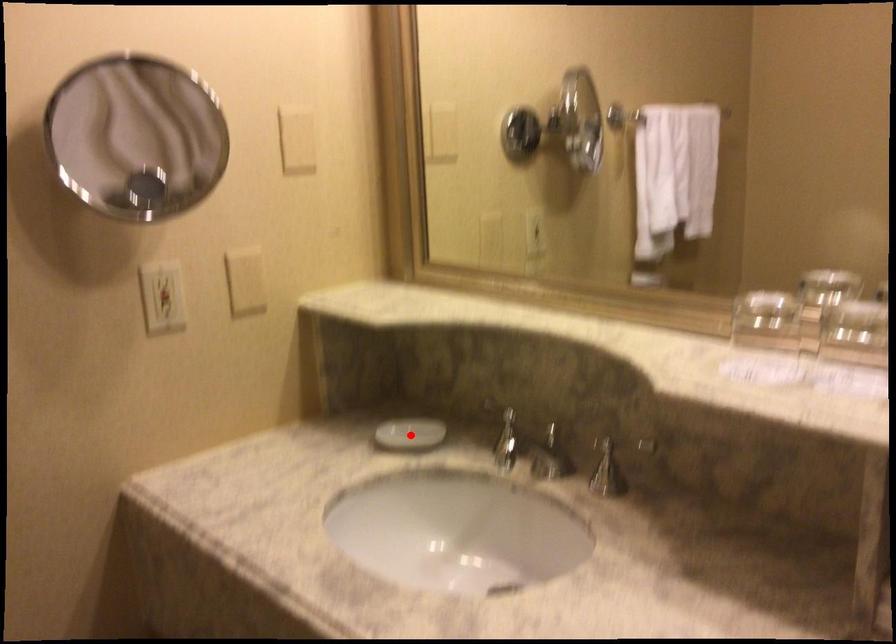
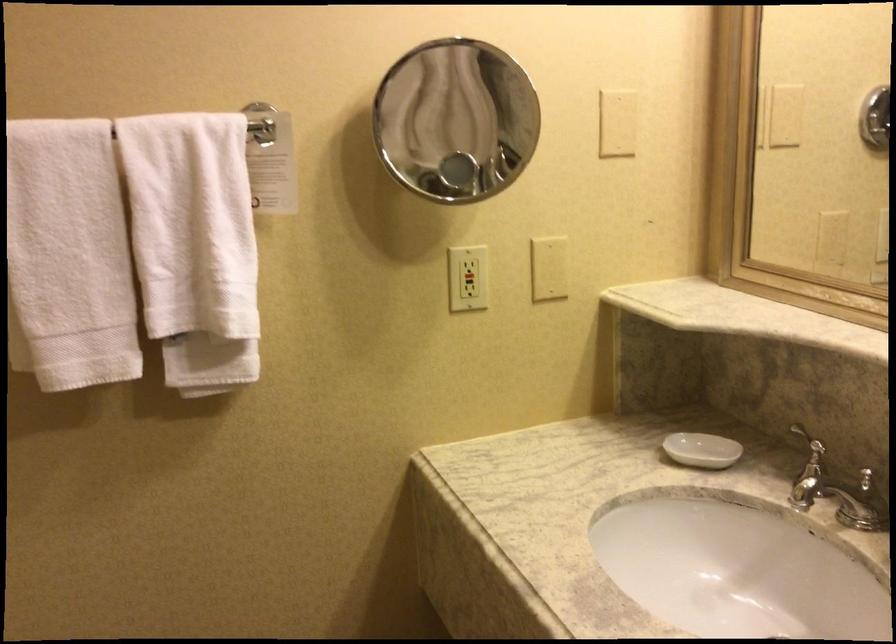
In the second image, find the point that corresponds to the highlighted location in the first image.

(702, 450)